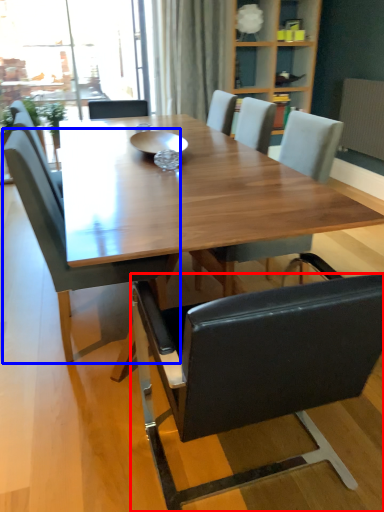
Question: Among these objects, which one is nearest to the camera, chair (highlighted by a red box) or chair (highlighted by a blue box)?

Choices:
 (A) chair
 (B) chair

Answer: (A)